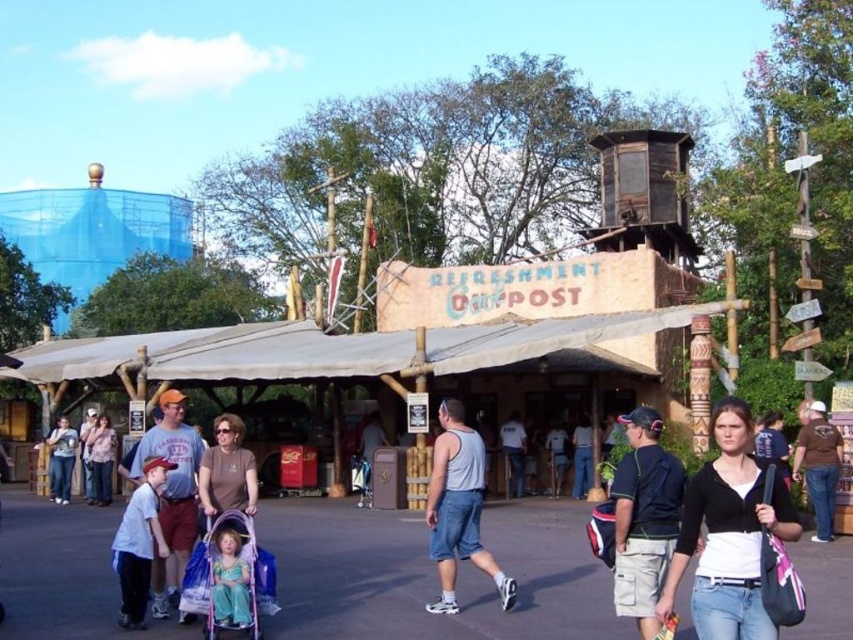
Which is behind, point (776, 492) or point (256, 628)?

Positioned behind is point (256, 628).

Between black cotton shirt at lower right and purple fabric stroller at center, which one appears on the right side from the viewer's perspective?

black cotton shirt at lower right

Find the location of a particular element. black cotton shirt at lower right is located at coordinates (729, 532).

Is matte pink shirt at center below matte gray shirt at left?

Incorrect, matte pink shirt at center is not positioned below matte gray shirt at left.

Is matte pink shirt at center bigger than matte gray shirt at left?

No.

Is point (90, 449) behind point (67, 468)?

No, (90, 449) is closer to viewer.

The image size is (853, 640). What are the coordinates of `matte pink shirt at center` in the screenshot? It's located at pyautogui.click(x=102, y=460).

Does turquoise fabric dress at lower center have a greater height compared to matte pink shirt at center?

No.

Is point (219, 602) closer to viewer compared to point (90, 474)?

Yes, point (219, 602) is in front of point (90, 474).

Does point (233, 600) come in front of point (107, 435)?

Yes, point (233, 600) is in front of point (107, 435).

Image resolution: width=853 pixels, height=640 pixels. What are the coordinates of `turquoise fabric dress at lower center` in the screenshot? It's located at (230, 580).